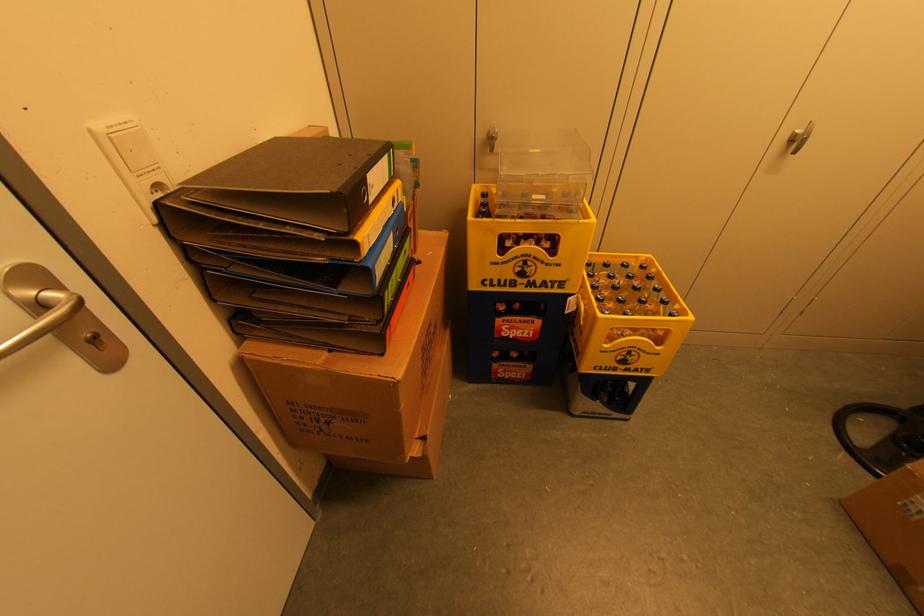
Describe the element at coordinates (132, 160) in the screenshot. The width and height of the screenshot is (924, 616). I see `the white light switch` at that location.